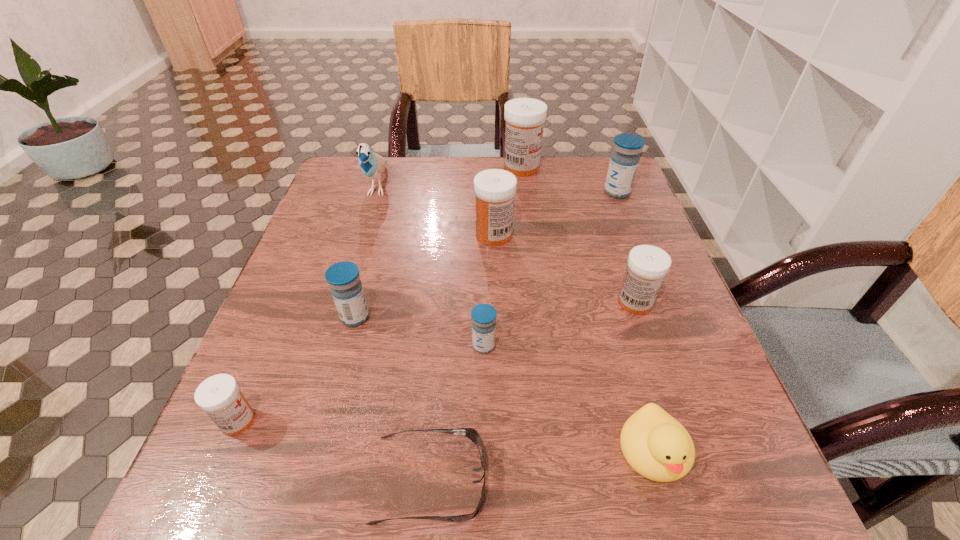
Locate an element on the screen. free location that satisfies the following two spatial constraints: 1. on the face of the duckling; 2. on the front-facing side of the shortest object is located at coordinates (662, 479).